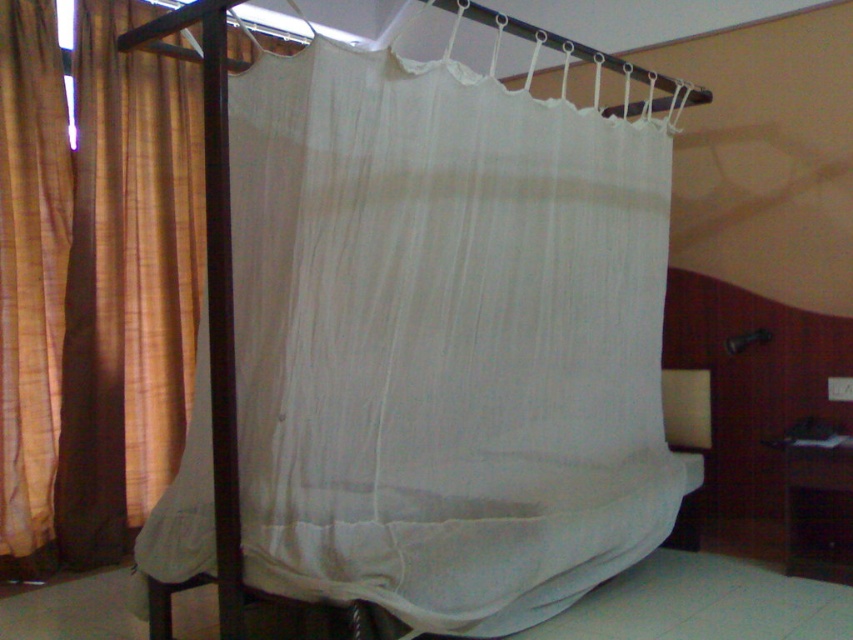
Question: Can you confirm if white cotton sheet at center is bigger than brown textured fabric at left?

Choices:
 (A) no
 (B) yes

Answer: (B)

Question: Can you confirm if white cotton sheet at center is positioned above brown textured fabric at left?

Choices:
 (A) yes
 (B) no

Answer: (B)

Question: Which object is farther from the camera taking this photo?

Choices:
 (A) brown textured fabric at left
 (B) white cotton sheet at center

Answer: (A)

Question: Which point is closer to the camera taking this photo?

Choices:
 (A) (412, 456)
 (B) (51, 404)

Answer: (A)

Question: Is white cotton sheet at center positioned at the back of brown textured fabric at left?

Choices:
 (A) yes
 (B) no

Answer: (B)

Question: Among these points, which one is nearest to the camera?

Choices:
 (A) (480, 492)
 (B) (20, 534)

Answer: (A)